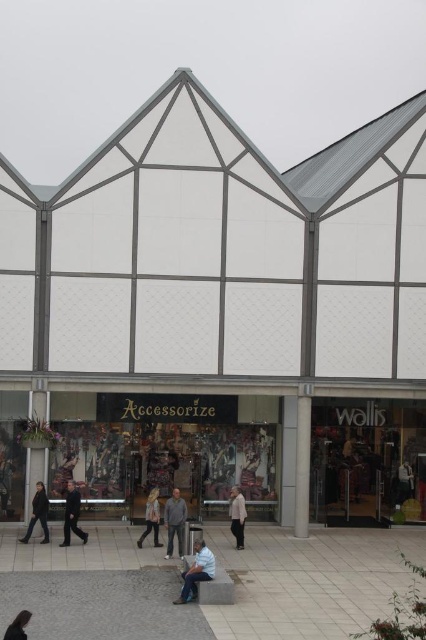
You are a customer standing in front of the modern commercial building. You notice the white matte mall at center and the light beige shirt at center. Which object is positioned higher from the ground?

The white matte mall at center is above the light beige shirt at center, so it is positioned higher from the ground.

Looking at this image, you are a customer looking to buy a shirt. You see a gray cotton shirt at center and a light beige shirt at center. Which shirt is smaller in size?

The gray cotton shirt at center is smaller in size compared to the light beige shirt at center.

Based on the photo, you are standing in front of the modern commercial building and want to take a photo of the two points marked on the building. Which point, point (172,499) or point (233,515), will appear larger in your camera view?

Point (172,499) will appear larger in the camera view because it is closer to the camera than point (233,515).